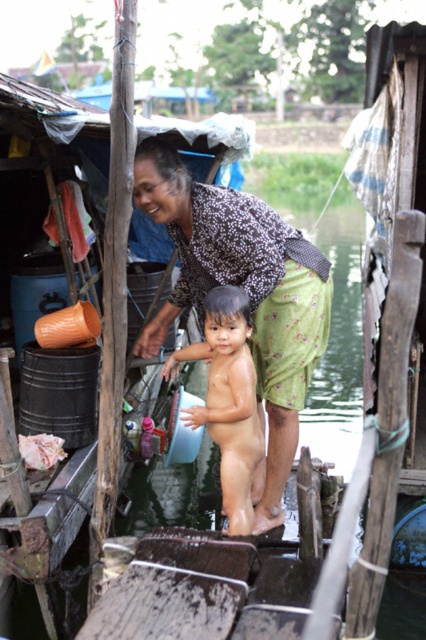
Question: Which point is closer to the camera taking this photo?

Choices:
 (A) (218, 417)
 (B) (138, 202)

Answer: (A)

Question: Which point is farther to the camera?

Choices:
 (A) (311, 292)
 (B) (250, 356)

Answer: (A)

Question: Can you confirm if printed fabric shirt at center is positioned to the left of smooth skin baby at center?

Choices:
 (A) no
 (B) yes

Answer: (B)

Question: Which of the following is the closest to the observer?

Choices:
 (A) (270, 524)
 (B) (244, 369)

Answer: (B)

Question: Can you confirm if printed fabric shirt at center is positioned above smooth skin baby at center?

Choices:
 (A) no
 (B) yes

Answer: (B)

Question: Observing the image, what is the correct spatial positioning of printed fabric shirt at center in reference to smooth skin baby at center?

Choices:
 (A) left
 (B) right

Answer: (A)